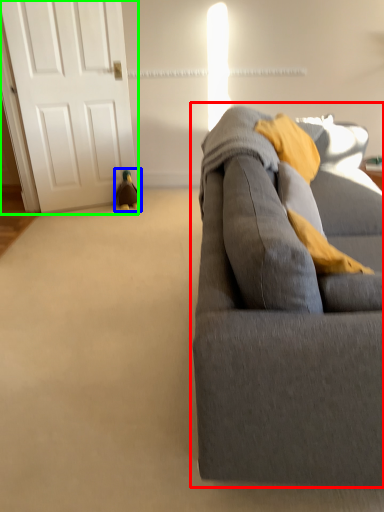
Question: Considering the real-world distances, which object is farthest from studio couch (highlighted by a red box)? toy (highlighted by a blue box) or door (highlighted by a green box)?

Choices:
 (A) toy
 (B) door

Answer: (A)